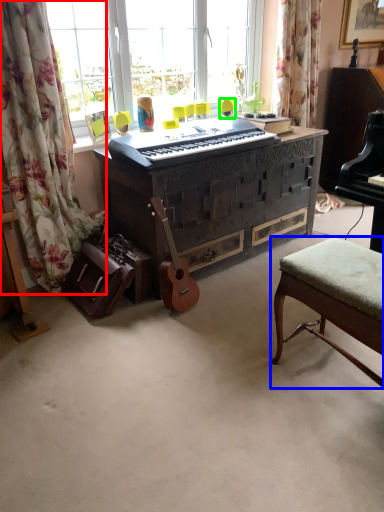
Question: Which is nearer to the curtain (highlighted by a red box)? stool (highlighted by a blue box) or swivel chair (highlighted by a green box).

Choices:
 (A) stool
 (B) swivel chair

Answer: (A)